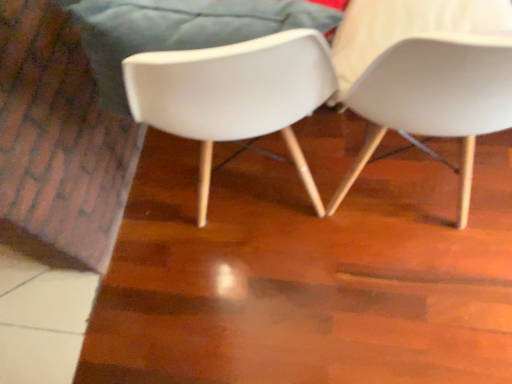
Locate an element on the screen. white matte chair at center, the 1th chair from the left is located at coordinates (234, 95).

This screenshot has width=512, height=384. What do you see at coordinates (234, 95) in the screenshot?
I see `white matte chair at center, the second chair in the right-to-left sequence` at bounding box center [234, 95].

Find the location of a particular element. white plastic chair at right, arranged as the first chair when viewed from the right is located at coordinates (434, 98).

What do you see at coordinates (434, 98) in the screenshot? I see `white plastic chair at right, arranged as the first chair when viewed from the right` at bounding box center [434, 98].

Measure the distance between point (505, 53) and camera.

Point (505, 53) is 20.67 inches from camera.

In order to click on white matte chair at center, the second chair in the right-to-left sequence in this screenshot , I will do `click(234, 95)`.

Does white matte chair at center, the second chair in the right-to-left sequence, appear on the right side of white plastic chair at right, which appears as the 2th chair when viewed from the left?

Answer: In fact, white matte chair at center, the second chair in the right-to-left sequence, is to the left of white plastic chair at right, which appears as the 2th chair when viewed from the left.

Is the position of white matte chair at center, the 1th chair from the left, more distant than that of white plastic chair at right, arranged as the first chair when viewed from the right?

Yes, white matte chair at center, the 1th chair from the left, is behind white plastic chair at right, arranged as the first chair when viewed from the right.

Does point (170, 51) come farther from viewer compared to point (357, 100)?

No, it is in front of (357, 100).

From the image's perspective, is white matte chair at center, the 1th chair from the left, positioned above or below white plastic chair at right, which appears as the 2th chair when viewed from the left?

white matte chair at center, the 1th chair from the left, is situated higher than white plastic chair at right, which appears as the 2th chair when viewed from the left, in the image.

From a real-world perspective, who is located higher, white matte chair at center, the second chair in the right-to-left sequence, or white plastic chair at right, arranged as the first chair when viewed from the right?

In real-world perspective, white plastic chair at right, arranged as the first chair when viewed from the right, is above.

Is white matte chair at center, the 1th chair from the left, wider than white plastic chair at right, which appears as the 2th chair when viewed from the left?

Correct, the width of white matte chair at center, the 1th chair from the left, exceeds that of white plastic chair at right, which appears as the 2th chair when viewed from the left.

Can you confirm if white matte chair at center, the 1th chair from the left, is shorter than white plastic chair at right, arranged as the first chair when viewed from the right?

No.

Who is smaller, white matte chair at center, the second chair in the right-to-left sequence, or white plastic chair at right, arranged as the first chair when viewed from the right?

Smaller between the two is white matte chair at center, the second chair in the right-to-left sequence.

In the scene shown: Is white matte chair at center, the 1th chair from the left, located outside white plastic chair at right, which appears as the 2th chair when viewed from the left?

Yes, white matte chair at center, the 1th chair from the left, is located beyond the bounds of white plastic chair at right, which appears as the 2th chair when viewed from the left.

Is the surface of white matte chair at center, the 1th chair from the left, in direct contact with white plastic chair at right, which appears as the 2th chair when viewed from the left?

No, white matte chair at center, the 1th chair from the left, is not in contact with white plastic chair at right, which appears as the 2th chair when viewed from the left.

Is white matte chair at center, the 1th chair from the left, facing towards white plastic chair at right, which appears as the 2th chair when viewed from the left?

No, white matte chair at center, the 1th chair from the left, is not aimed at white plastic chair at right, which appears as the 2th chair when viewed from the left.

How many degrees apart are the facing directions of white matte chair at center, the 1th chair from the left, and white plastic chair at right, arranged as the first chair when viewed from the right?

The angular difference between white matte chair at center, the 1th chair from the left, and white plastic chair at right, arranged as the first chair when viewed from the right, is 0.000208 degrees.

Could you measure the distance between white matte chair at center, the 1th chair from the left, and white plastic chair at right, which appears as the 2th chair when viewed from the left?

They are 22.47 centimeters apart.

Locate an element on the screen. This screenshot has height=384, width=512. chair located in front of the white matte chair at center, the 1th chair from the left is located at coordinates (434, 98).

Considering the relative positions of white plastic chair at right, which appears as the 2th chair when viewed from the left, and white matte chair at center, the second chair in the right-to-left sequence, in the image provided, is white plastic chair at right, which appears as the 2th chair when viewed from the left, to the left or to the right of white matte chair at center, the second chair in the right-to-left sequence,?

In the image, white plastic chair at right, which appears as the 2th chair when viewed from the left, appears on the right side of white matte chair at center, the second chair in the right-to-left sequence.

Which is behind, white plastic chair at right, arranged as the first chair when viewed from the right, or white matte chair at center, the 1th chair from the left?

white matte chair at center, the 1th chair from the left, is more distant.

Is point (494, 43) positioned after point (196, 138)?

No, (494, 43) is closer to viewer.

From the image's perspective, is white plastic chair at right, arranged as the first chair when viewed from the right, located above or below white matte chair at center, the second chair in the right-to-left sequence?

Clearly, from the image's perspective, white plastic chair at right, arranged as the first chair when viewed from the right, is below white matte chair at center, the second chair in the right-to-left sequence.

From a real-world perspective, is white plastic chair at right, arranged as the first chair when viewed from the right, positioned under white matte chair at center, the second chair in the right-to-left sequence, based on gravity?

No.

Between white plastic chair at right, which appears as the 2th chair when viewed from the left, and white matte chair at center, the 1th chair from the left, which one has larger width?

white matte chair at center, the 1th chair from the left.

Is white plastic chair at right, arranged as the first chair when viewed from the right, taller or shorter than white matte chair at center, the second chair in the right-to-left sequence?

Clearly, white plastic chair at right, arranged as the first chair when viewed from the right, is shorter compared to white matte chair at center, the second chair in the right-to-left sequence.

Who is smaller, white plastic chair at right, arranged as the first chair when viewed from the right, or white matte chair at center, the 1th chair from the left?

With smaller size is white matte chair at center, the 1th chair from the left.

Choose the correct answer: Is white plastic chair at right, which appears as the 2th chair when viewed from the left, inside white matte chair at center, the 1th chair from the left, or outside it?

white plastic chair at right, which appears as the 2th chair when viewed from the left, is spatially situated outside white matte chair at center, the 1th chair from the left.

Is white plastic chair at right, arranged as the first chair when viewed from the right, next to white matte chair at center, the second chair in the right-to-left sequence?

No, white plastic chair at right, arranged as the first chair when viewed from the right, is not in contact with white matte chair at center, the second chair in the right-to-left sequence.

Is white plastic chair at right, arranged as the first chair when viewed from the right, looking in the opposite direction of white matte chair at center, the second chair in the right-to-left sequence?

No, white plastic chair at right, arranged as the first chair when viewed from the right,'s orientation is not away from white matte chair at center, the second chair in the right-to-left sequence.

Can you tell me how much white plastic chair at right, which appears as the 2th chair when viewed from the left, and white matte chair at center, the 1th chair from the left, differ in facing direction?

The angular difference between white plastic chair at right, which appears as the 2th chair when viewed from the left, and white matte chair at center, the 1th chair from the left, is 0.000208 degrees.

The height and width of the screenshot is (384, 512). Find the location of `chair below the white matte chair at center, the 1th chair from the left (from the image's perspective)`. chair below the white matte chair at center, the 1th chair from the left (from the image's perspective) is located at coordinates (434, 98).

Locate an element on the screen. The image size is (512, 384). chair above the white matte chair at center, the second chair in the right-to-left sequence (from a real-world perspective) is located at coordinates (434, 98).

In the image, there is a white plastic chair at right, arranged as the first chair when viewed from the right. In order to click on chair above it (from the image's perspective) in this screenshot , I will do `click(234, 95)`.